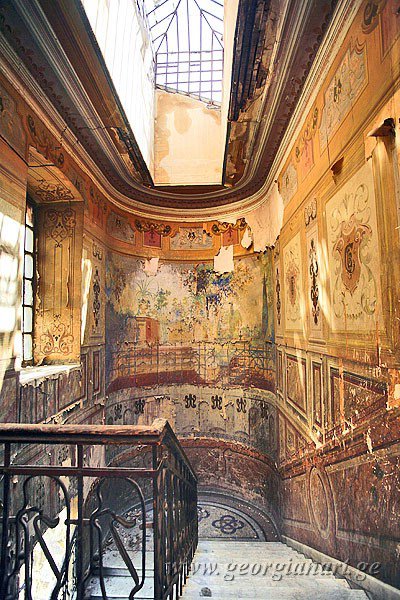
The image size is (400, 600). What are the coordinates of `peeling paint` in the screenshot? It's located at click(x=226, y=260), click(x=262, y=217), click(x=149, y=267), click(x=368, y=442), click(x=244, y=240), click(x=224, y=414).